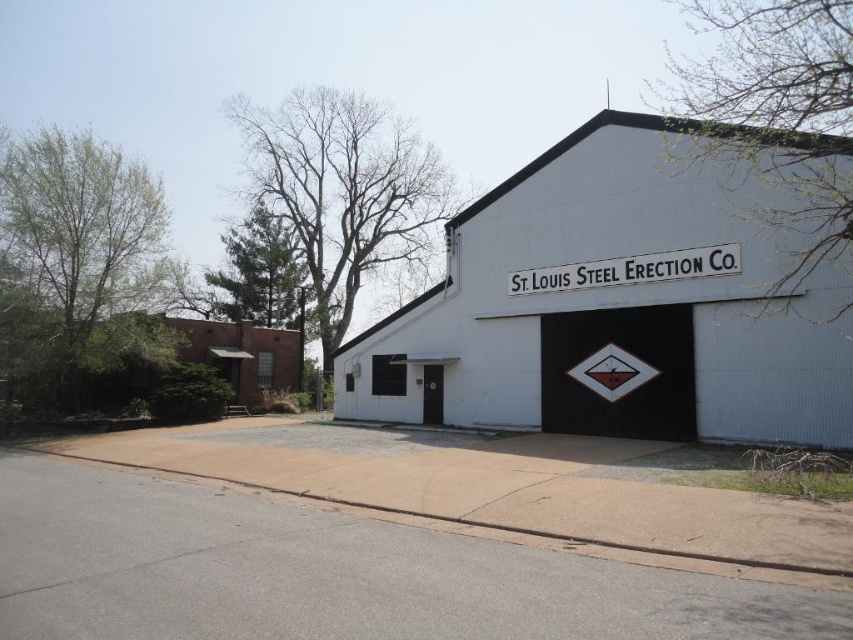
You are standing in front of the industrial building and want to locate the white painted signboard at center. According to the coordinates provided, where should you look to find it?

The white painted signboard at center is located at point coordinates (628, 269).